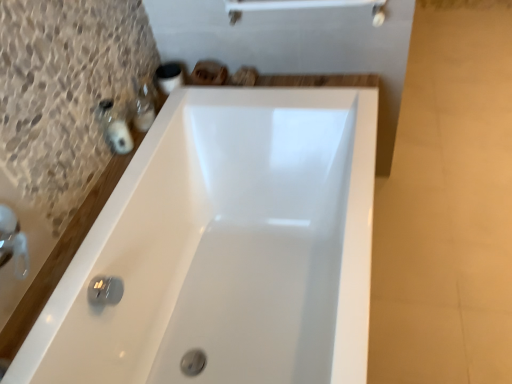
Question: Considering the relative positions of matte plastic soap dispenser at upper left, arranged as the 1th toiletry when viewed from the back, and matte black soap at left, the 2th toiletry when ordered from back to front, in the image provided, is matte plastic soap dispenser at upper left, arranged as the 1th toiletry when viewed from the back, to the left or to the right of matte black soap at left, the 2th toiletry when ordered from back to front,?

Choices:
 (A) left
 (B) right

Answer: (B)

Question: Is point (143, 96) closer or farther from the camera than point (108, 134)?

Choices:
 (A) closer
 (B) farther

Answer: (B)

Question: Which object is positioned closest to the white glossy bathtub at center?

Choices:
 (A) matte black soap at left, placed as the 1th toiletry when sorted from front to back
 (B) matte plastic soap dispenser at upper left, arranged as the 1th toiletry when viewed from the back

Answer: (A)

Question: Considering the real-world distances, which object is closest to the matte black soap at left, the 2th toiletry when ordered from back to front?

Choices:
 (A) matte plastic soap dispenser at upper left, which is the 2th toiletry from front to back
 (B) white glossy bathtub at center

Answer: (A)